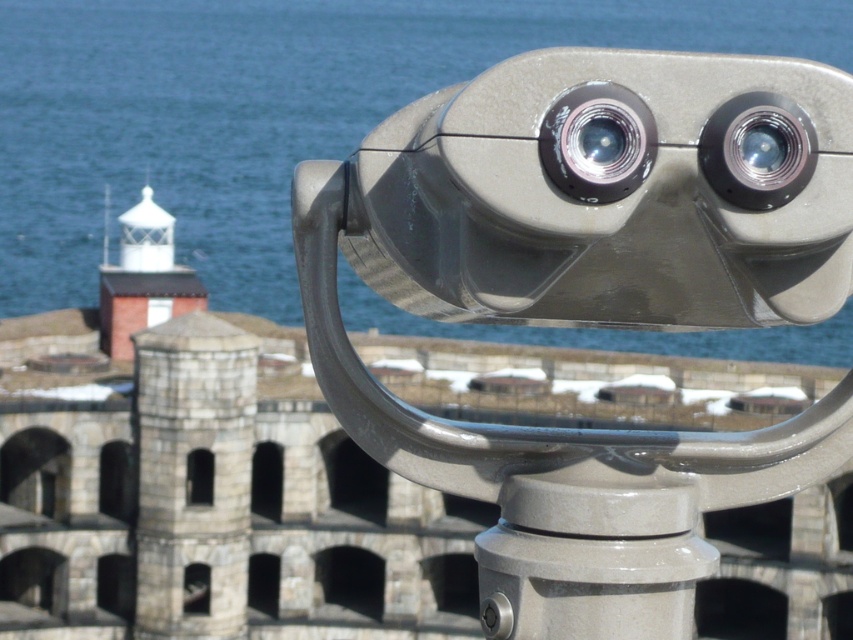
Which is below, blue water at upper center or matte silver lens at upper right?

Positioned lower is matte silver lens at upper right.

Can you confirm if blue water at upper center is taller than matte silver lens at upper right?

Yes, blue water at upper center is taller than matte silver lens at upper right.

Does point (16, 202) lie in front of point (769, 173)?

No, it is not.

Find the location of `blue water at upper center`. blue water at upper center is located at coordinates (270, 113).

Does matte metallic lens at center appear over matte silver lens at upper right?

Indeed, matte metallic lens at center is positioned over matte silver lens at upper right.

Is point (621, 173) closer to camera compared to point (793, 108)?

Yes.

Who is more distant from viewer, (590, 177) or (782, 170)?

A: The point (782, 170) is more distant.

Where is `matte metallic lens at center`? This screenshot has width=853, height=640. matte metallic lens at center is located at coordinates (596, 141).

Does satin silver telescope at center have a larger size compared to matte metallic lens at center?

Correct, satin silver telescope at center is larger in size than matte metallic lens at center.

Can you confirm if satin silver telescope at center is taller than matte metallic lens at center?

Yes.

Measure the distance between point (543,294) and camera.

The distance of point (543,294) from camera is 27.18 meters.

Where is `satin silver telescope at center`? This screenshot has height=640, width=853. satin silver telescope at center is located at coordinates (581, 317).